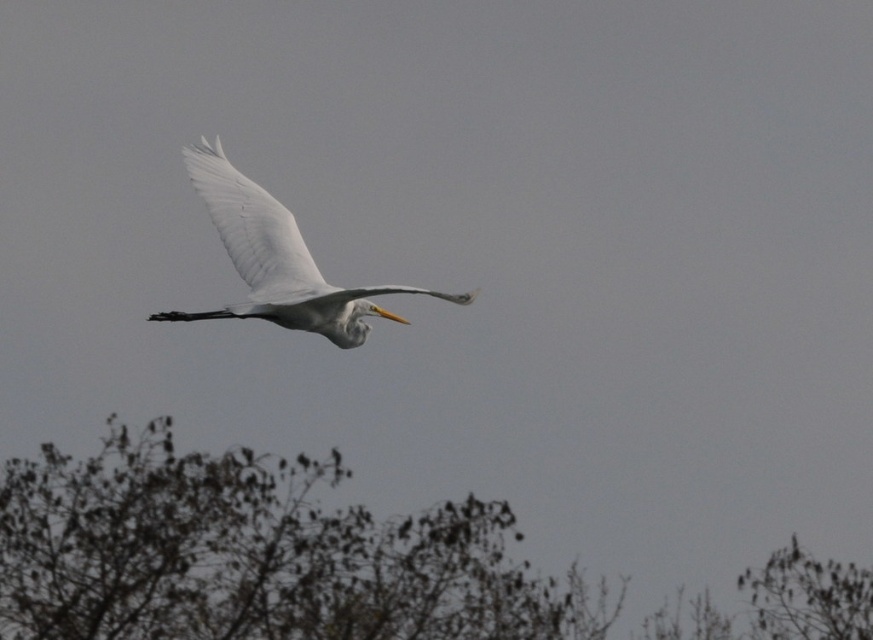
Question: Is brown textured tree at lower center thinner than white feathered wing at center?

Choices:
 (A) yes
 (B) no

Answer: (B)

Question: Is brown textured tree at lower center to the right of white feathered bird at center from the viewer's perspective?

Choices:
 (A) no
 (B) yes

Answer: (B)

Question: Which object appears farthest from the camera in this image?

Choices:
 (A) white feathered wing at center
 (B) brown textured tree at lower center

Answer: (B)

Question: Which object is positioned farthest from the brown textured tree at lower center?

Choices:
 (A) white feathered bird at center
 (B) white feathered wing at center

Answer: (A)

Question: Does white feathered bird at center come in front of white feathered wing at center?

Choices:
 (A) yes
 (B) no

Answer: (A)

Question: Which object is closer to the camera taking this photo?

Choices:
 (A) white feathered bird at center
 (B) brown textured tree at lower center
 (C) white feathered wing at center

Answer: (A)